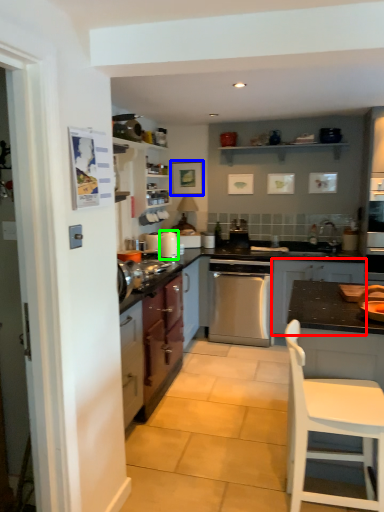
Question: Which is farther away from cabinetry (highlighted by a red box)? picture frame (highlighted by a blue box) or kitchen appliance (highlighted by a green box)?

Choices:
 (A) picture frame
 (B) kitchen appliance

Answer: (A)